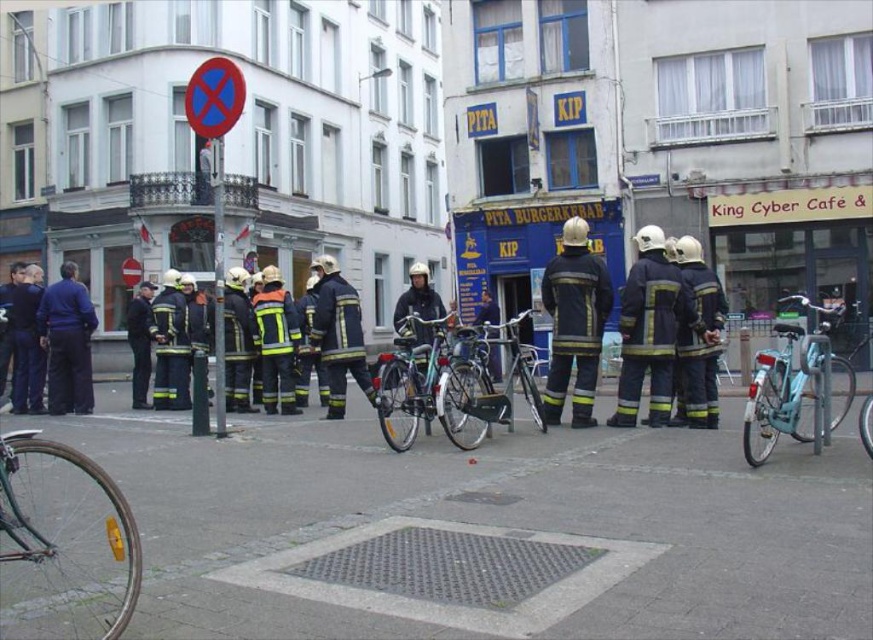
Between reflective silver helmet at center and red circular sign at upper left, which one has more height?

Standing taller between the two is red circular sign at upper left.

Which is more to the left, reflective silver helmet at center or red circular sign at upper left?

red circular sign at upper left

Does point (558, 413) come closer to viewer compared to point (214, 81)?

No, (558, 413) is further to viewer.

You are a GUI agent. You are given a task and a screenshot of the screen. Output one action in this format:
    pyautogui.click(x=<x>, y=<y>)
    Task: Click on the reflective silver helmet at center
    The height and width of the screenshot is (640, 873).
    Given the screenshot: What is the action you would take?
    pos(574,323)

This screenshot has width=873, height=640. Describe the element at coordinates (430, 385) in the screenshot. I see `shiny silver bicycle at center` at that location.

In the scene shown: How much distance is there between shiny silver bicycle at center and reflective silver helmet at center?

A distance of 1.38 meters exists between shiny silver bicycle at center and reflective silver helmet at center.

What do you see at coordinates (430, 385) in the screenshot?
I see `shiny silver bicycle at center` at bounding box center [430, 385].

You are a GUI agent. You are given a task and a screenshot of the screen. Output one action in this format:
    pyautogui.click(x=<x>, y=<y>)
    Task: Click on the shiny silver bicycle at center
    The image size is (873, 640).
    Given the screenshot: What is the action you would take?
    [430, 385]

What do you see at coordinates (796, 385) in the screenshot?
I see `light blue metallic bicycle at lower right` at bounding box center [796, 385].

Is light blue metallic bicycle at lower right further to the viewer compared to reflective silver helmet at center?

No.

The image size is (873, 640). Find the location of `light blue metallic bicycle at lower right`. light blue metallic bicycle at lower right is located at coordinates (796, 385).